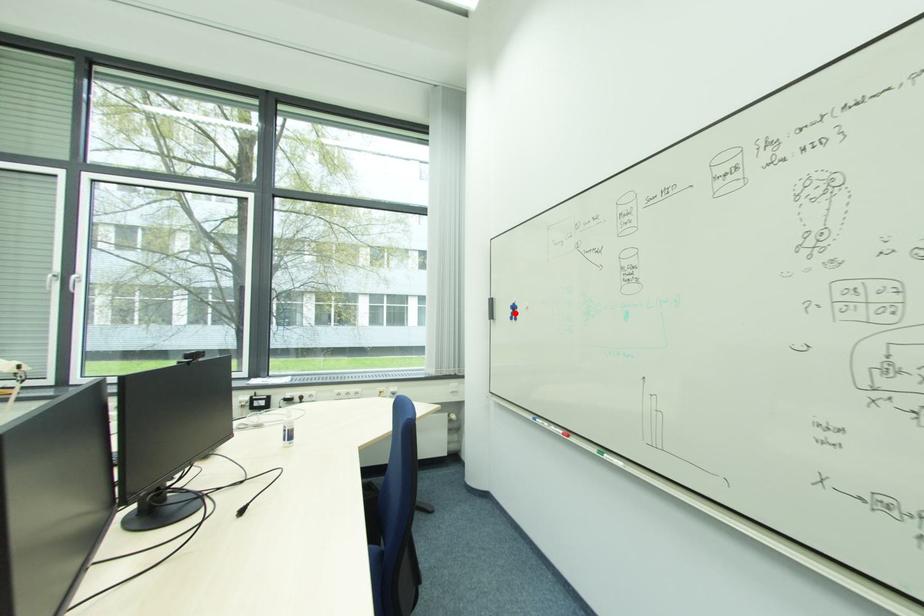
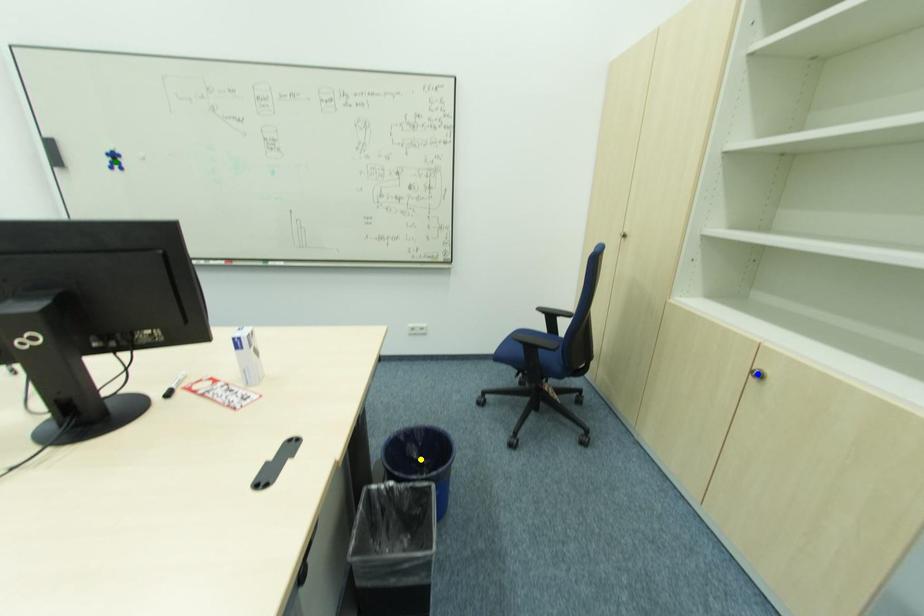
Question: I am providing you with two images of the same scene from different viewpoints. A red point is marked on the first image. You are given multiple points on the second image. In image 2, which mark is for the same physical point as the one in image 1?

Choices:
 (A) yellow point
 (B) blue point
 (C) green point

Answer: (C)